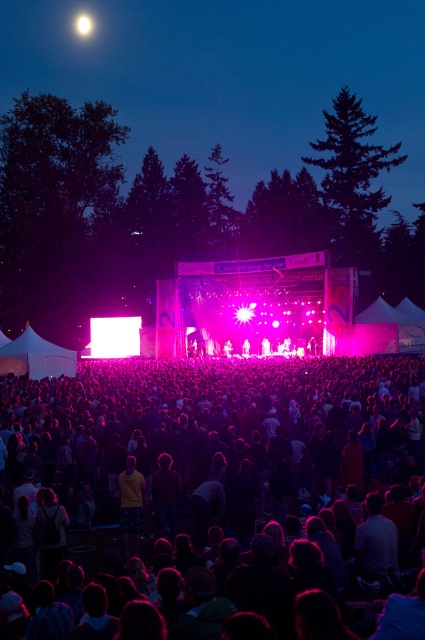
Can you confirm if black fabric crowd at center is shorter than yellow cotton shirt at center?

No, black fabric crowd at center is not shorter than yellow cotton shirt at center.

Based on the photo, who is shorter, black fabric crowd at center or yellow cotton shirt at center?

yellow cotton shirt at center is shorter.

Locate an element on the screen. The height and width of the screenshot is (640, 425). black fabric crowd at center is located at coordinates (227, 476).